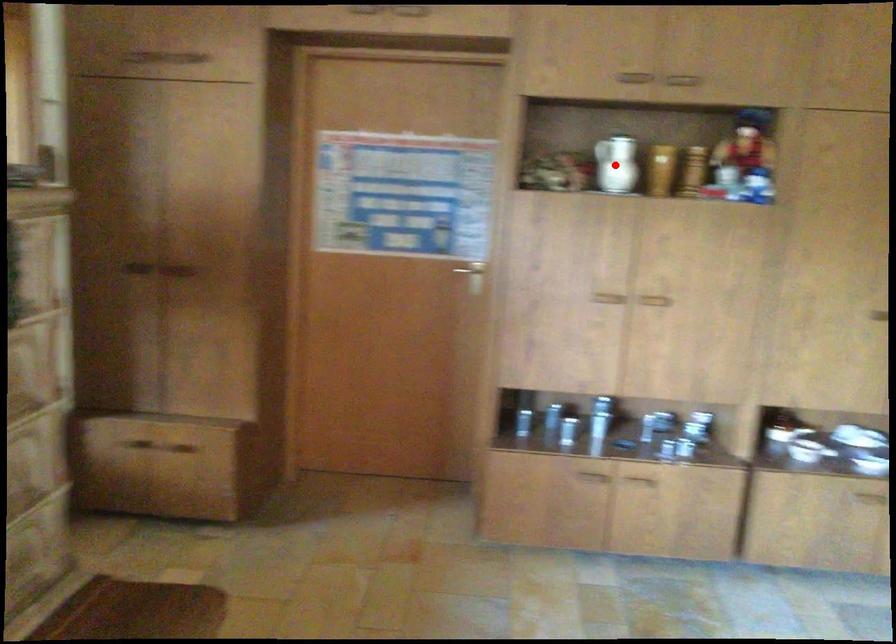
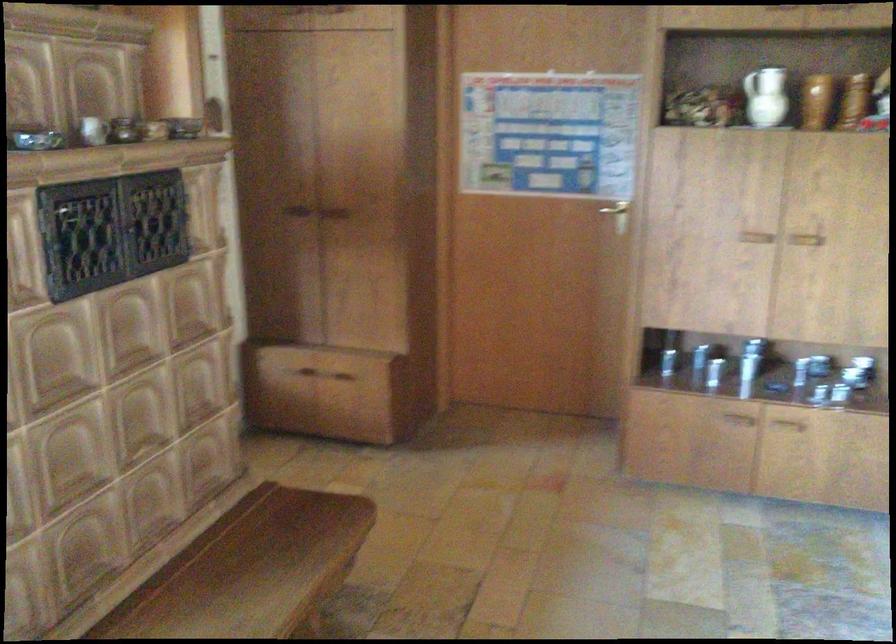
In the second image, find the point that corresponds to the highlighted location in the first image.

(764, 96)